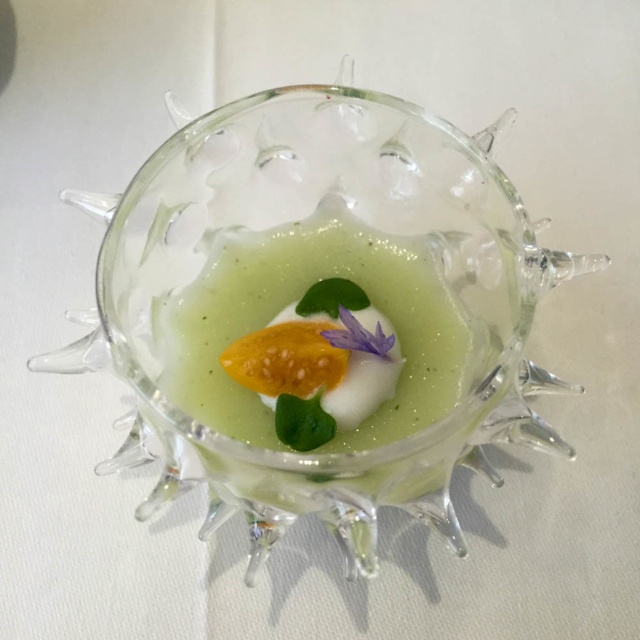
Describe the element at coordinates (321, 310) in the screenshot. I see `transparent glass bowl at center` at that location.

Between point (371, 454) and point (406, 294), which one is positioned behind?

The point (406, 294) is behind.

This screenshot has height=640, width=640. I want to click on transparent glass bowl at center, so click(x=321, y=310).

Is point (246, 209) in front of point (308, 294)?

No, (246, 209) is further to viewer.

Can you confirm if transparent glass bowl at center is shorter than matte yellow fruit at center?

No, transparent glass bowl at center is not shorter than matte yellow fruit at center.

What are the coordinates of `transparent glass bowl at center` in the screenshot? It's located at (321, 310).

Based on the photo, is green gelatinous at center closer to camera compared to matte yellow fruit at center?

No.

Which is more to the left, green gelatinous at center or matte yellow fruit at center?

Positioned to the left is green gelatinous at center.

Identify the location of green gelatinous at center. (298, 298).